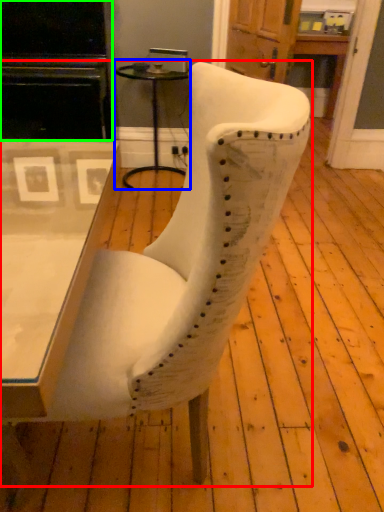
Question: Estimate the real-world distances between objects in this image. Which object is closer to chair (highlighted by a red box), side table (highlighted by a blue box) or entertainment center (highlighted by a green box)?

Choices:
 (A) side table
 (B) entertainment center

Answer: (B)